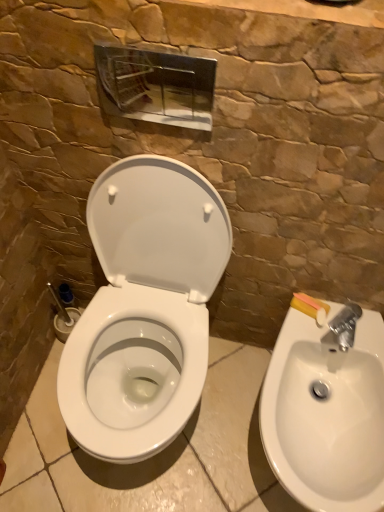
Question: Relative to white glossy toilet at center, is white glossy sink at lower right in front or behind?

Choices:
 (A) front
 (B) behind

Answer: (B)

Question: Would you say white glossy sink at lower right is inside or outside white glossy toilet at center?

Choices:
 (A) outside
 (B) inside

Answer: (A)

Question: In terms of size, does white glossy sink at lower right appear bigger or smaller than white glossy toilet at center?

Choices:
 (A) small
 (B) big

Answer: (A)

Question: Relative to white glossy sink at lower right, is white glossy toilet at center in front or behind?

Choices:
 (A) behind
 (B) front

Answer: (B)

Question: Do you think white glossy toilet at center is within white glossy sink at lower right, or outside of it?

Choices:
 (A) inside
 (B) outside

Answer: (B)

Question: Would you say white glossy toilet at center is to the left or to the right of white glossy sink at lower right in the picture?

Choices:
 (A) right
 (B) left

Answer: (B)

Question: Considering the positions of point (190, 174) and point (339, 373), is point (190, 174) closer or farther from the camera than point (339, 373)?

Choices:
 (A) farther
 (B) closer

Answer: (B)